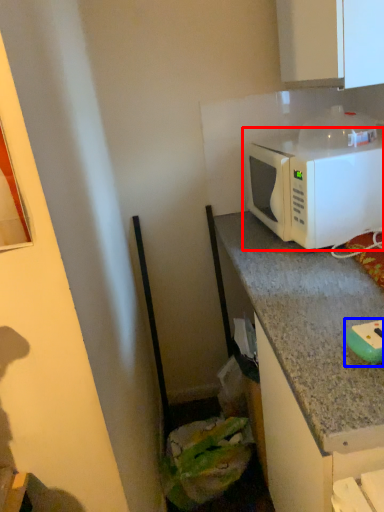
Question: Which point is closer to the camera, microwave oven (highlighted by a red box) or appliance (highlighted by a blue box)?

Choices:
 (A) microwave oven
 (B) appliance

Answer: (B)